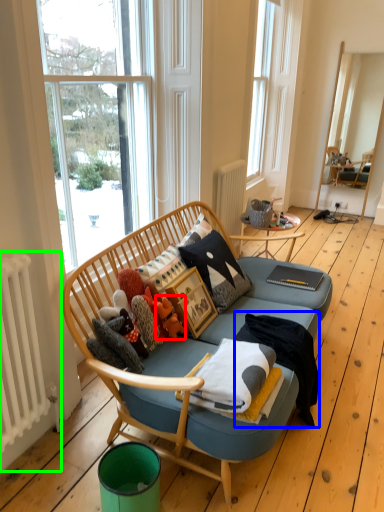
Question: Which object is the closest to the toy (highlighted by a red box)? Choose among these: blanket (highlighted by a blue box) or radiator (highlighted by a green box).

Choices:
 (A) blanket
 (B) radiator

Answer: (A)